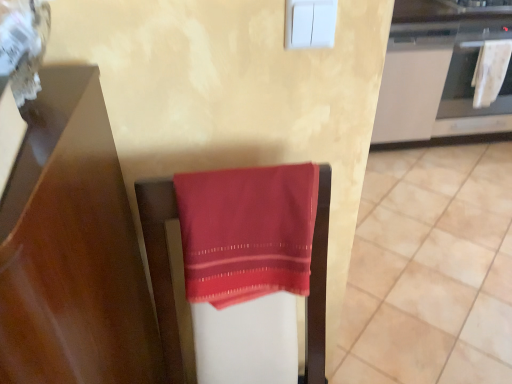
Describe the element at coordinates (431, 269) in the screenshot. I see `smooth red towel at center` at that location.

What is the approximate width of smooth red towel at center?

1.81 meters.

At what (x,y) coordinates should I click in order to perform the action: click on white glossy cabinet at upper right. Please return your answer as a coordinate pair (x, y). Image resolution: width=512 pixels, height=384 pixels. Looking at the image, I should click on (413, 81).

This screenshot has height=384, width=512. Describe the element at coordinates (413, 81) in the screenshot. I see `white glossy cabinet at upper right` at that location.

What do you see at coordinates (474, 87) in the screenshot?
I see `white fabric oven at upper right` at bounding box center [474, 87].

Measure the distance between point (x=499, y=90) and camera.

Point (x=499, y=90) is 2.54 meters away from camera.

The image size is (512, 384). I want to click on white textured towel at right, so click(490, 71).

Where is `smooth red towel at center`? The height and width of the screenshot is (384, 512). smooth red towel at center is located at coordinates (431, 269).

Is satin red cloth at center closer to the viewer compared to white textured towel at right?

Yes, satin red cloth at center is closer to the viewer.

Is satin red cloth at center far from white textured towel at right?

Absolutely, satin red cloth at center is distant from white textured towel at right.

Considering the relative positions of satin red cloth at center and white textured towel at right in the image provided, is satin red cloth at center to the right of white textured towel at right from the viewer's perspective?

In fact, satin red cloth at center is to the left of white textured towel at right.

Is satin red cloth at center oriented away from white textured towel at right?

satin red cloth at center does not have its back to white textured towel at right.

From the picture: Which object is more forward, satin red cloth at center or smooth red towel at center?

Positioned in front is satin red cloth at center.

Do you think satin red cloth at center is within smooth red towel at center, or outside of it?

satin red cloth at center is not enclosed by smooth red towel at center.

Is satin red cloth at center smaller than smooth red towel at center?

Yes, satin red cloth at center is smaller than smooth red towel at center.

Which object is thinner, white fabric oven at upper right or white textured towel at right?

Thinner between the two is white textured towel at right.

Which of these two, white fabric oven at upper right or white textured towel at right, is bigger?

Bigger between the two is white fabric oven at upper right.

Which is correct: white fabric oven at upper right is inside white textured towel at right, or outside of it?

white fabric oven at upper right is outside white textured towel at right.

Is point (504, 31) more distant than point (494, 96)?

No, (504, 31) is in front of (494, 96).

Based on the photo, is the surface of white glossy cabinet at upper right in direct contact with white fabric oven at upper right?

white glossy cabinet at upper right is not next to white fabric oven at upper right, and they're not touching.

Is white glossy cabinet at upper right taller or shorter than white fabric oven at upper right?

white glossy cabinet at upper right is taller than white fabric oven at upper right.

Consider the image. Is white glossy cabinet at upper right oriented away from white fabric oven at upper right?

No, white glossy cabinet at upper right is not facing away from white fabric oven at upper right.

Who is smaller, white glossy cabinet at upper right or white fabric oven at upper right?

white fabric oven at upper right.

Looking at this image, is white glossy cabinet at upper right at the back of white fabric oven at upper right?

No, white fabric oven at upper right is not facing away from white glossy cabinet at upper right.

What's the angular difference between white fabric oven at upper right and white glossy cabinet at upper right's facing directions?

The facing directions of white fabric oven at upper right and white glossy cabinet at upper right are 1.75e-05 degrees apart.

Can you confirm if white fabric oven at upper right is thinner than white glossy cabinet at upper right?

Indeed, white fabric oven at upper right has a lesser width compared to white glossy cabinet at upper right.

From a real-world perspective, is white fabric oven at upper right positioned above or below white glossy cabinet at upper right?

white fabric oven at upper right is situated higher than white glossy cabinet at upper right in the real world.

Considering the relative sizes of white glossy cabinet at upper right and smooth red towel at center in the image provided, is white glossy cabinet at upper right taller than smooth red towel at center?

Indeed, white glossy cabinet at upper right has a greater height compared to smooth red towel at center.

Which object is positioned more to the right, white glossy cabinet at upper right or smooth red towel at center?

smooth red towel at center.

Based on the photo, is white glossy cabinet at upper right bigger than smooth red towel at center?

No.

From the image's perspective, does white glossy cabinet at upper right appear lower than smooth red towel at center?

Incorrect, from the image's perspective, white glossy cabinet at upper right is higher than smooth red towel at center.

Where is `beach towel above the white glossy cabinet at upper right (from a real-world perspective)`? beach towel above the white glossy cabinet at upper right (from a real-world perspective) is located at coordinates (490, 71).

Is point (399, 74) in front of point (488, 79)?

Yes, it is.

Is white textured towel at right located within white glossy cabinet at upper right?

Definitely not — white textured towel at right is not inside white glossy cabinet at upper right.

The image size is (512, 384). I want to click on furniture above the white textured towel at right (from a real-world perspective), so click(x=166, y=277).

What are the coordinates of `tile below the satin red cloth at center (from a real-world perspective)` in the screenshot? It's located at (431, 269).

In the scene shown: When comparing their distances from white textured towel at right, does white glossy cabinet at upper right or smooth red towel at center seem further?

Based on the image, smooth red towel at center appears to be further to white textured towel at right.

Based on their spatial positions, is white fabric oven at upper right or white textured towel at right further from smooth red towel at center?

white textured towel at right lies further to smooth red towel at center than the other object.

From the picture: Which object lies further to the anchor point white glossy cabinet at upper right, white textured towel at right or satin red cloth at center?

Based on the image, satin red cloth at center appears to be further to white glossy cabinet at upper right.

From the image, which object appears to be nearer to smooth red towel at center, white glossy cabinet at upper right or white fabric oven at upper right?

The object closer to smooth red towel at center is white glossy cabinet at upper right.

Looking at the image, which one is located closer to white fabric oven at upper right, white textured towel at right or smooth red towel at center?

white textured towel at right is positioned closer to the anchor white fabric oven at upper right.

When comparing their distances from smooth red towel at center, does white fabric oven at upper right or white glossy cabinet at upper right seem closer?

white glossy cabinet at upper right is positioned closer to the anchor smooth red towel at center.

Estimate the real-world distances between objects in this image. Which object is closer to white fabric oven at upper right, satin red cloth at center or white textured towel at right?

white textured towel at right lies closer to white fabric oven at upper right than the other object.

Looking at the image, which one is located closer to white textured towel at right, satin red cloth at center or white glossy cabinet at upper right?

white glossy cabinet at upper right.

Find the location of a particular element. This screenshot has height=384, width=512. tile located between satin red cloth at center and white textured towel at right in the depth direction is located at coordinates [431, 269].

This screenshot has height=384, width=512. I want to click on beach towel located between white glossy cabinet at upper right and white fabric oven at upper right in the left-right direction, so click(490, 71).

You are a GUI agent. You are given a task and a screenshot of the screen. Output one action in this format:
    pyautogui.click(x=<x>, y=<y>)
    Task: Click on the tile between satin red cloth at center and white fabric oven at upper right along the z-axis
    This screenshot has width=512, height=384.
    Given the screenshot: What is the action you would take?
    pyautogui.click(x=431, y=269)

At what (x,y) coordinates should I click in order to perform the action: click on beach towel between white glossy cabinet at upper right and smooth red towel at center in the vertical direction. Please return your answer as a coordinate pair (x, y). Looking at the image, I should click on (490, 71).